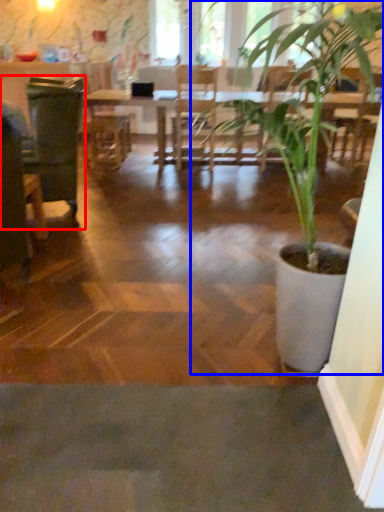
Question: Which of the following is the farthest to the observer, swivel chair (highlighted by a red box) or houseplant (highlighted by a blue box)?

Choices:
 (A) swivel chair
 (B) houseplant

Answer: (A)